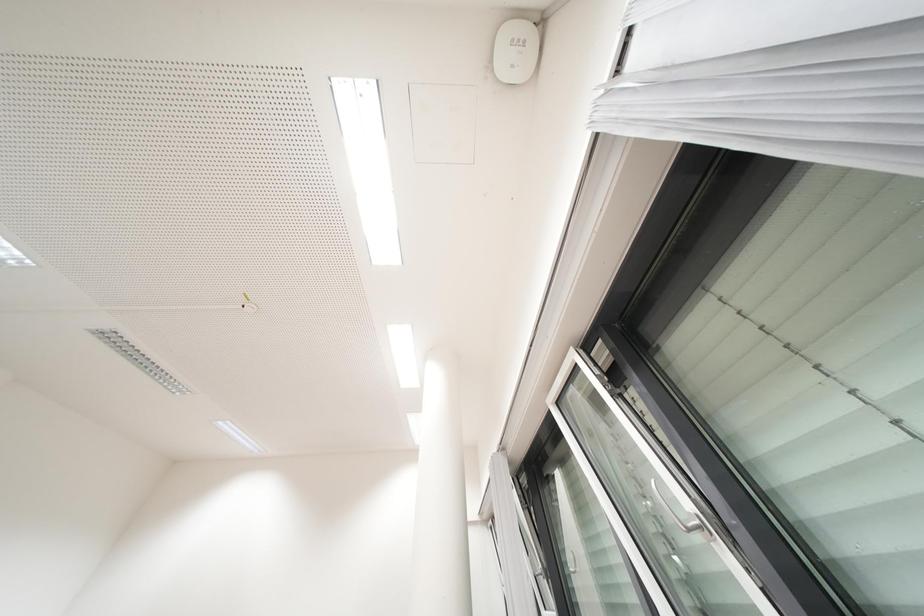
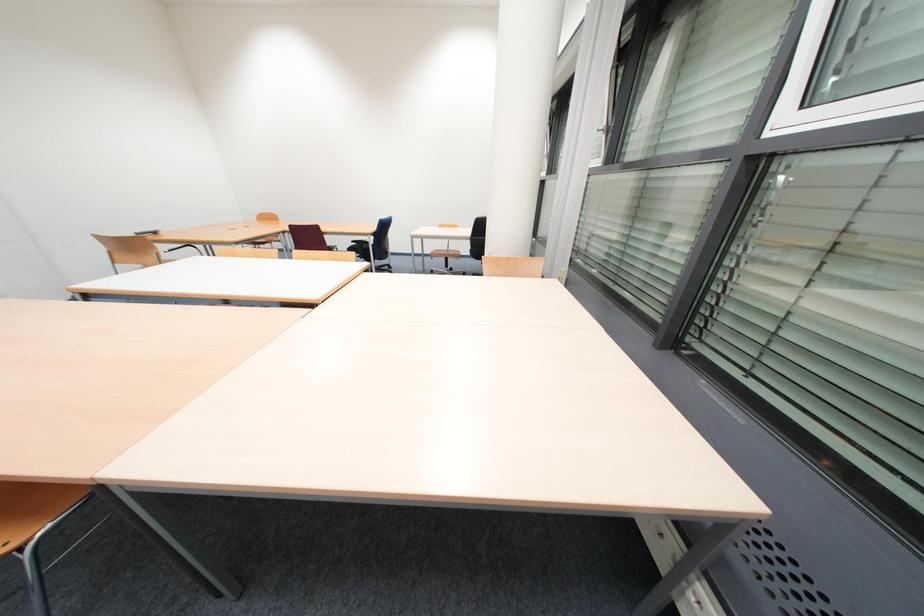
Question: How did the camera likely rotate?

Choices:
 (A) Left
 (B) Right
 (C) Up
 (D) Down

Answer: (D)